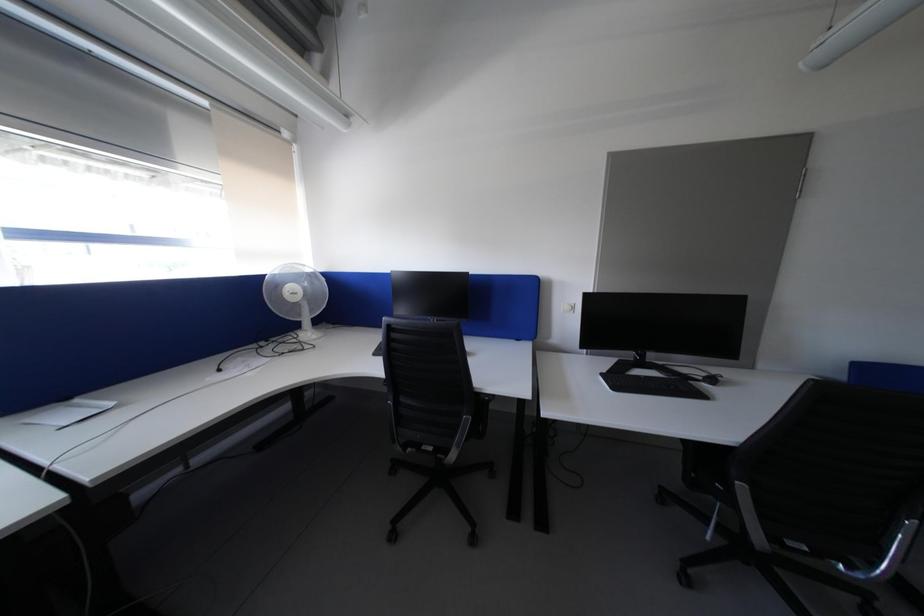
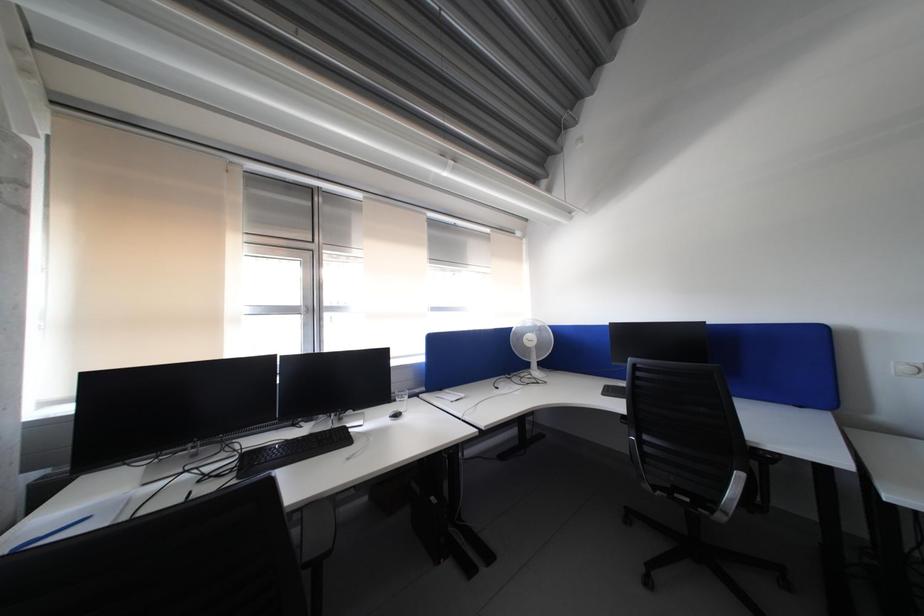
Question: The camera is either moving clockwise (left) or counter-clockwise (right) around the object. The first image is from the beginning of the video and the second image is from the end. Is the camera moving left or right when shooting the video?

Choices:
 (A) Left
 (B) Right

Answer: (B)